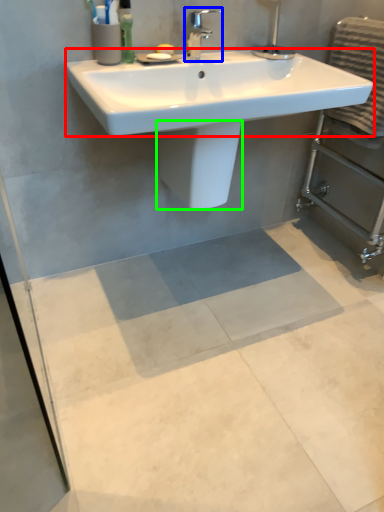
Question: Estimate the real-world distances between objects in this image. Which object is farther from counter top (highlighted by a red box), tap (highlighted by a blue box) or bidet (highlighted by a green box)?

Choices:
 (A) tap
 (B) bidet

Answer: (A)